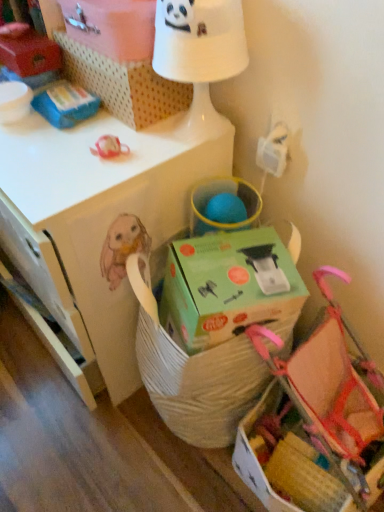
Question: From the image's perspective, is white matte desk at center on top of pink fabric baby carriage at lower right?

Choices:
 (A) yes
 (B) no

Answer: (A)

Question: Does white matte desk at center have a smaller size compared to pink fabric baby carriage at lower right?

Choices:
 (A) yes
 (B) no

Answer: (B)

Question: Considering the relative sizes of white matte desk at center and pink fabric baby carriage at lower right in the image provided, is white matte desk at center wider than pink fabric baby carriage at lower right?

Choices:
 (A) no
 (B) yes

Answer: (A)

Question: Does white matte desk at center lie behind pink fabric baby carriage at lower right?

Choices:
 (A) no
 (B) yes

Answer: (B)

Question: From a real-world perspective, is white matte desk at center over pink fabric baby carriage at lower right?

Choices:
 (A) yes
 (B) no

Answer: (A)

Question: Can you confirm if white matte desk at center is shorter than pink fabric baby carriage at lower right?

Choices:
 (A) yes
 (B) no

Answer: (B)

Question: Is pink fabric baby carriage at lower right turned away from green cardboard box at center, which ranks as the first cardboard box in bottom-to-top order?

Choices:
 (A) yes
 (B) no

Answer: (B)

Question: Can you confirm if pink fabric baby carriage at lower right is taller than green cardboard box at center, which ranks as the first cardboard box in bottom-to-top order?

Choices:
 (A) yes
 (B) no

Answer: (A)

Question: Is pink fabric baby carriage at lower right far away from green cardboard box at center, the 2th cardboard box viewed from the top?

Choices:
 (A) no
 (B) yes

Answer: (A)

Question: Is pink fabric baby carriage at lower right closer to camera compared to green cardboard box at center, which ranks as the first cardboard box in bottom-to-top order?

Choices:
 (A) no
 (B) yes

Answer: (B)

Question: From a real-world perspective, is pink fabric baby carriage at lower right physically below green cardboard box at center, the 2th cardboard box viewed from the top?

Choices:
 (A) yes
 (B) no

Answer: (A)

Question: Does pink fabric baby carriage at lower right have a lesser width compared to green cardboard box at center, the 2th cardboard box viewed from the top?

Choices:
 (A) yes
 (B) no

Answer: (B)

Question: Are white cardboard box at upper center, which is the first storage box in right-to-left order, and white cardboard box at upper center, the 1th cardboard box when ordered from top to bottom, far apart?

Choices:
 (A) no
 (B) yes

Answer: (A)